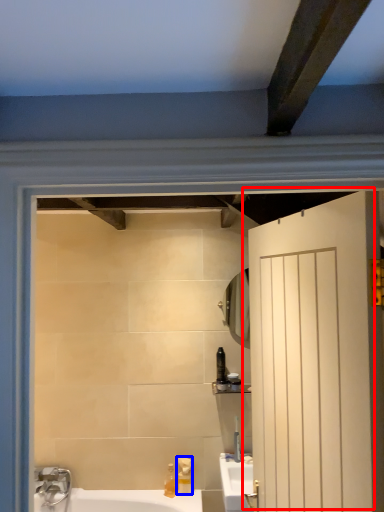
Question: Which of the following is the farthest to the observer, door (highlighted by a red box) or soap dispenser (highlighted by a blue box)?

Choices:
 (A) door
 (B) soap dispenser

Answer: (B)